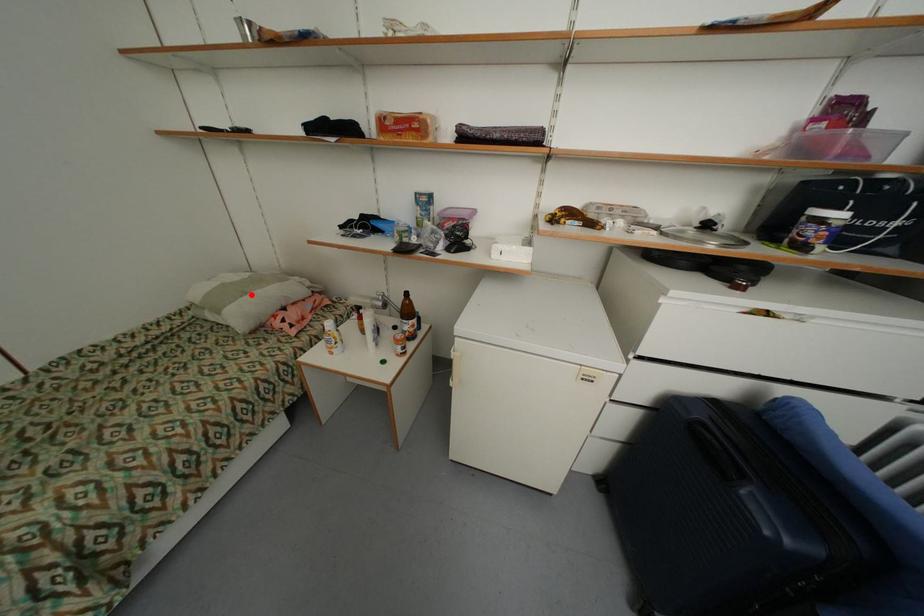
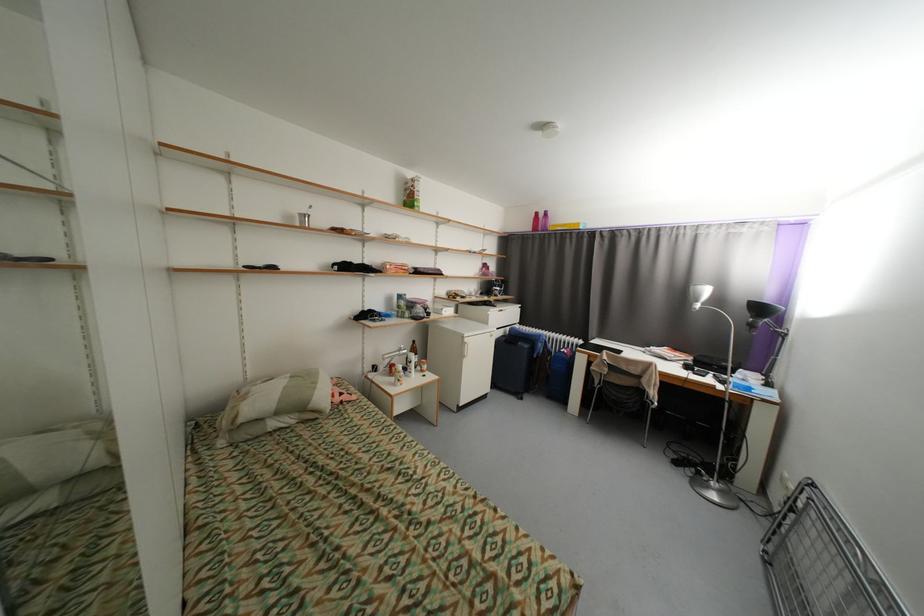
Find the pixel in the second image that matches the highlighted location in the first image.

(322, 384)